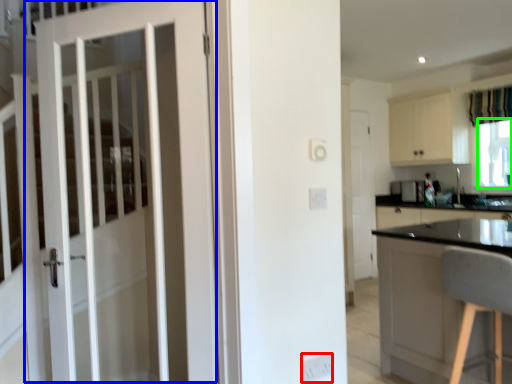
Question: Which object is positioned closest to electric outlet (highlighted by a red box)? Select from door (highlighted by a blue box) and window screen (highlighted by a green box).

Choices:
 (A) door
 (B) window screen

Answer: (A)